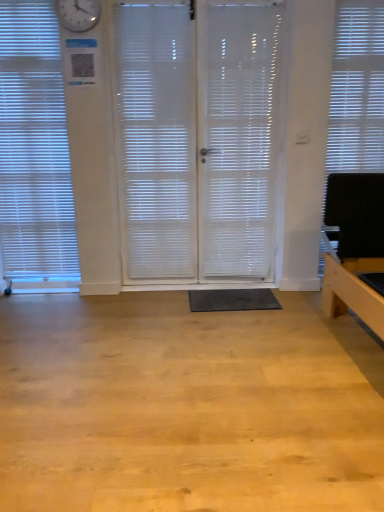
Where is `free spot above black rubber mat at center (from a real-world perspective)`? free spot above black rubber mat at center (from a real-world perspective) is located at coordinates (242, 295).